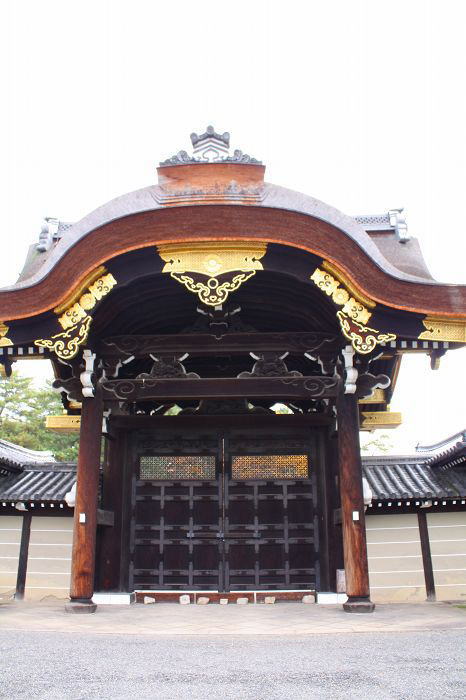
Where is `base of column`? base of column is located at coordinates (369, 606), (75, 607).